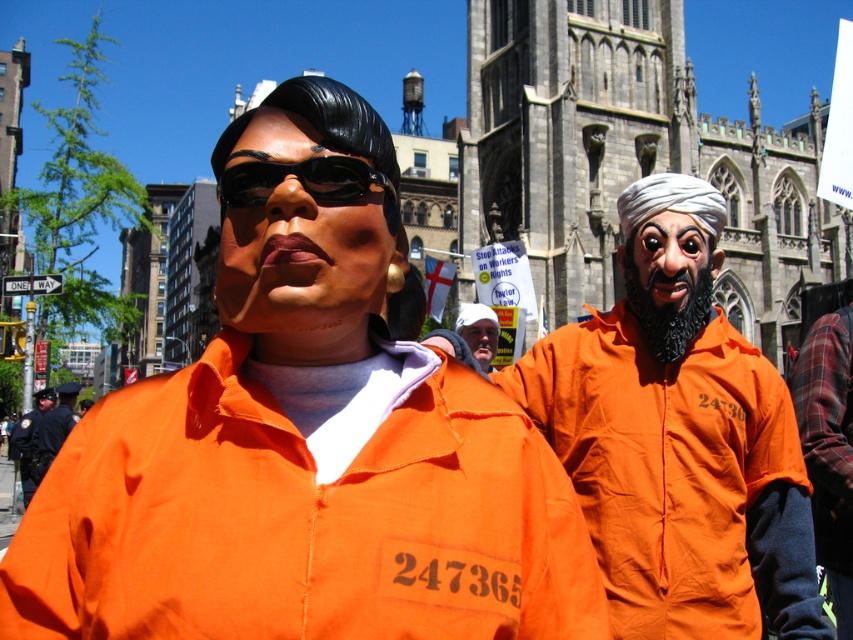
Can you confirm if smooth orange mask at center is bigger than black uniform at left?

Incorrect, smooth orange mask at center is not larger than black uniform at left.

I want to click on smooth orange mask at center, so click(x=672, y=257).

Where is `smooth orange mask at center`? smooth orange mask at center is located at coordinates (672, 257).

Is black uniform at left further to the viewer compared to matte plastic head at center?

Yes.

Is black uniform at left to the right of matte plastic head at center from the viewer's perspective?

No, black uniform at left is not to the right of matte plastic head at center.

Who is more forward, (19, 458) or (477, 356)?

Point (477, 356) is more forward.

Where is `black uniform at left`? black uniform at left is located at coordinates (28, 444).

Is orange prison jumpsuit at center further to the viewer compared to matte orange jumpsuit at center?

No, orange prison jumpsuit at center is closer to the viewer.

Between point (61, 400) and point (39, 406), which one is positioned behind?

Positioned behind is point (39, 406).

Which is in front, point (45, 428) or point (42, 400)?

Point (45, 428)

In order to click on orange prison jumpsuit at center in this screenshot , I will do [x=54, y=428].